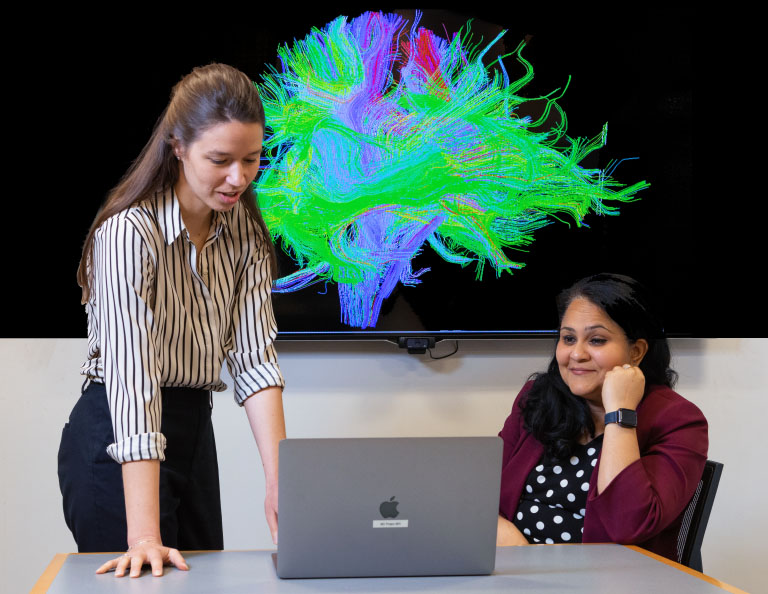
You are a GUI agent. You are given a task and a screenshot of the screen. Output one action in this format:
    pyautogui.click(x=<x>, y=<y>)
    Task: Click on the name label on laptop
    
    Given the screenshot: What is the action you would take?
    pyautogui.click(x=388, y=521)